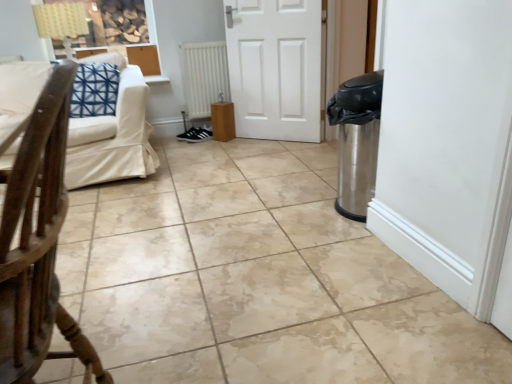
Question: From a real-world perspective, is wooden chair at left on top of black suede sneakers at center?

Choices:
 (A) yes
 (B) no

Answer: (A)

Question: Can black suede sneakers at center be found inside wooden chair at left?

Choices:
 (A) no
 (B) yes

Answer: (A)

Question: From the image's perspective, is wooden chair at left above black suede sneakers at center?

Choices:
 (A) yes
 (B) no

Answer: (B)

Question: Considering the relative sizes of wooden chair at left and black suede sneakers at center in the image provided, is wooden chair at left shorter than black suede sneakers at center?

Choices:
 (A) no
 (B) yes

Answer: (A)

Question: Is wooden chair at left facing away from black suede sneakers at center?

Choices:
 (A) yes
 (B) no

Answer: (B)

Question: Is white matte radiator at center inside the boundaries of black suede sneakers at center, or outside?

Choices:
 (A) inside
 (B) outside

Answer: (B)

Question: From the image's perspective, is white matte radiator at center located above or below black suede sneakers at center?

Choices:
 (A) below
 (B) above

Answer: (B)

Question: From a real-world perspective, is white matte radiator at center positioned above or below black suede sneakers at center?

Choices:
 (A) above
 (B) below

Answer: (A)

Question: Considering the positions of white matte radiator at center and black suede sneakers at center in the image, is white matte radiator at center wider or thinner than black suede sneakers at center?

Choices:
 (A) wide
 (B) thin

Answer: (B)

Question: From their relative heights in the image, would you say wooden chair at left is taller or shorter than beige fabric couch at upper left?

Choices:
 (A) tall
 (B) short

Answer: (A)

Question: Does point (105, 372) appear closer or farther from the camera than point (88, 114)?

Choices:
 (A) farther
 (B) closer

Answer: (B)

Question: Is wooden chair at left situated inside beige fabric couch at upper left or outside?

Choices:
 (A) inside
 (B) outside

Answer: (B)

Question: From a real-world perspective, is wooden chair at left physically located above or below beige fabric couch at upper left?

Choices:
 (A) below
 (B) above

Answer: (B)

Question: From the image's perspective, is black suede sneakers at center above or below wooden chair at left?

Choices:
 (A) below
 (B) above

Answer: (B)

Question: Based on their sizes in the image, would you say black suede sneakers at center is bigger or smaller than wooden chair at left?

Choices:
 (A) small
 (B) big

Answer: (A)